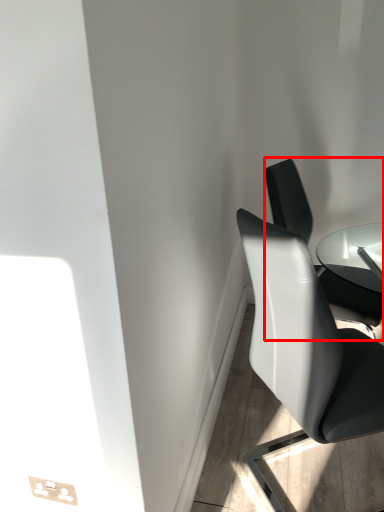
Question: From the image's perspective, considering the relative positions of chair (annotated by the red box) and chair in the image provided, where is chair (annotated by the red box) located with respect to the staircase?

Choices:
 (A) below
 (B) above

Answer: (B)